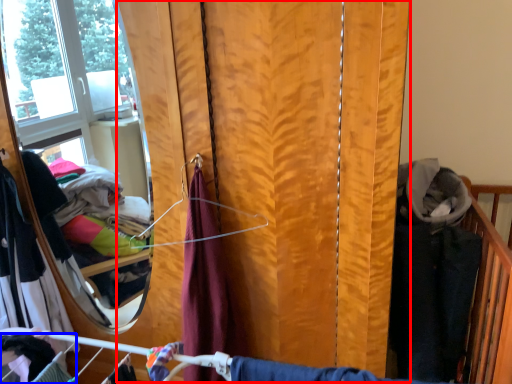
Question: Which of the following is the closest to the observer, curtain (highlighted by a red box) or clothing (highlighted by a blue box)?

Choices:
 (A) curtain
 (B) clothing

Answer: (B)